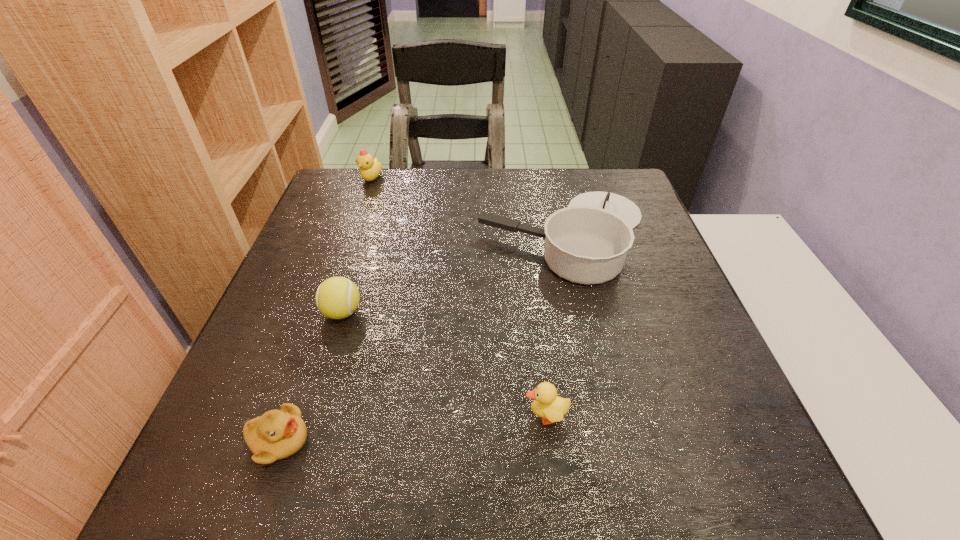
Find the location of a particular element. The height and width of the screenshot is (540, 960). the tallest duckling is located at coordinates (370, 169).

Where is `the farthest object`? This screenshot has height=540, width=960. the farthest object is located at coordinates (370, 169).

Find the location of a particular element. saucepan is located at coordinates (587, 242).

The width and height of the screenshot is (960, 540). Find the location of `the third farthest object`. the third farthest object is located at coordinates (337, 297).

The height and width of the screenshot is (540, 960). I want to click on the rightmost duckling, so click(551, 408).

I want to click on vacant space located 0.380m on the front-facing side of the farthest duckling, so click(339, 275).

Where is `free space located 0.310m on the front of the second farthest object`? free space located 0.310m on the front of the second farthest object is located at coordinates (606, 417).

Locate an element on the screen. The width and height of the screenshot is (960, 540). blank space located on the front of the third farthest object is located at coordinates (294, 470).

You are a GUI agent. You are given a task and a screenshot of the screen. Output one action in this format:
    pyautogui.click(x=<x>, y=<y>)
    Task: Click on the vacant space located on the front-facing side of the rightmost duckling
    The width and height of the screenshot is (960, 540).
    Given the screenshot: What is the action you would take?
    pyautogui.click(x=383, y=416)

I want to click on free location located 0.200m on the front-facing side of the rightmost duckling, so click(x=407, y=416).